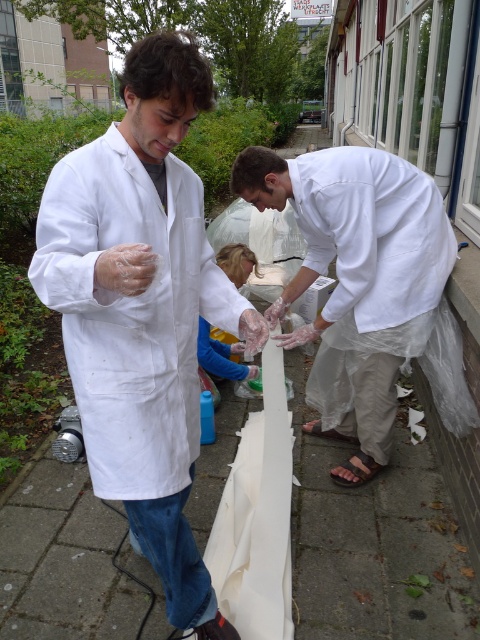
You are a safety inspector checking the lab coats in the image. You need to ensure that the lab coats meet the minimum width requirement of 1.2 meters. Which lab coat between the white matte lab coat at center and the white matte lab coat at right is wider?

The white matte lab coat at center is wider than the white matte lab coat at right, so it meets the width requirement better.

You are a visitor at the STADSWERKPLAATS UTRECHT facility and want to approach the person in the white matte lab coat at center. However, there is a person in the white matte lab coat at right blocking your path. Which direction should you move to go around them and reach the person you want?

You should move to the right side of the white matte lab coat at right to reach the white matte lab coat at center since the white matte lab coat at center is to the left of white matte lab coat at right.

You are a photographer standing at the camera position. You need to take a closeup photo of the white matte lab coat at center. Can you get a clear shot without moving the coat?

The white matte lab coat at center is 38.02 inches away from camera, so yes, you can get a clear closeup shot without moving the coat as it is within a reasonable distance for focusing.